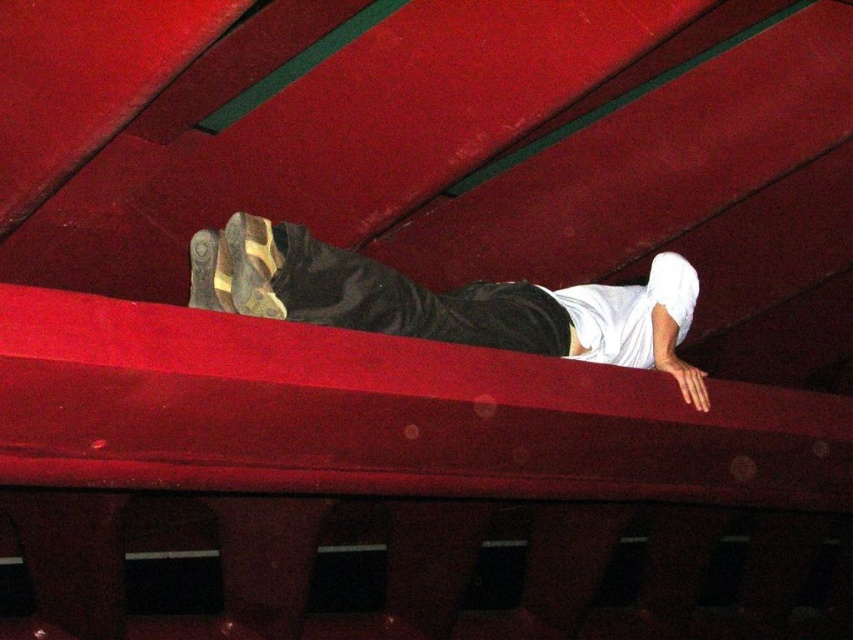
You are standing in front of the red surface where the person is resting. There are two points marked on the surface. One is at coordinates point (59, 324) and the other is at point (538, 323). Which point is closer to you?

Point (59, 324) is closer to the camera than point (538, 323), so the point at coordinates point (59, 324) is closer to you.

You are standing in front of a structure with a smooth red beam at center. You want to place a 3.5 feet long box on the beam. Will the box fit on the beam?

The smooth red beam at center is 3.39 feet away from the camera, but the distance from the beam to the camera does not indicate its length. Therefore, we cannot determine if the 3.5 feet long box will fit on the beam based on the provided information.